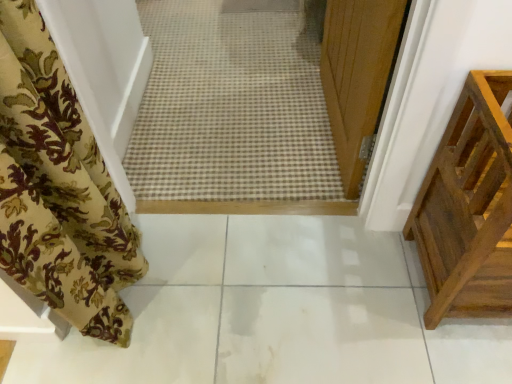
Identify the location of free spot to the right of floral fabric curtain at left. (208, 279).